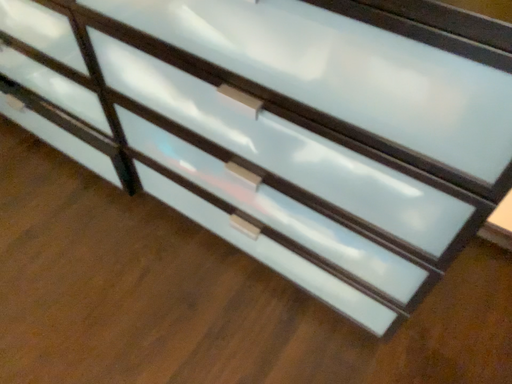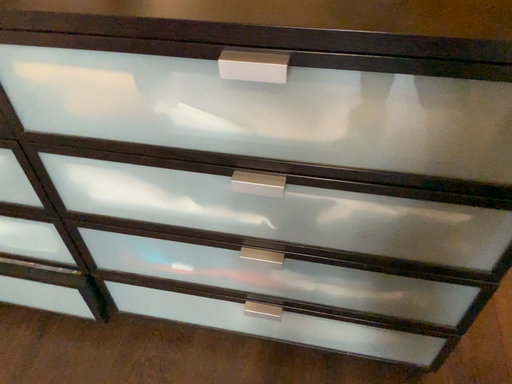
Question: Which way did the camera rotate in the video?

Choices:
 (A) rotated right
 (B) rotated left

Answer: (A)